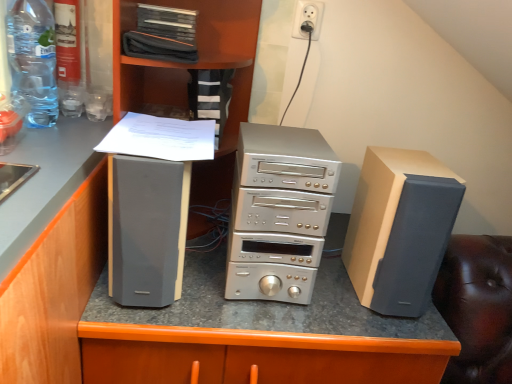
The height and width of the screenshot is (384, 512). Identify the location of vacant space that's between silver metallic stereo stack at center and matte gray speaker at left. (206, 284).